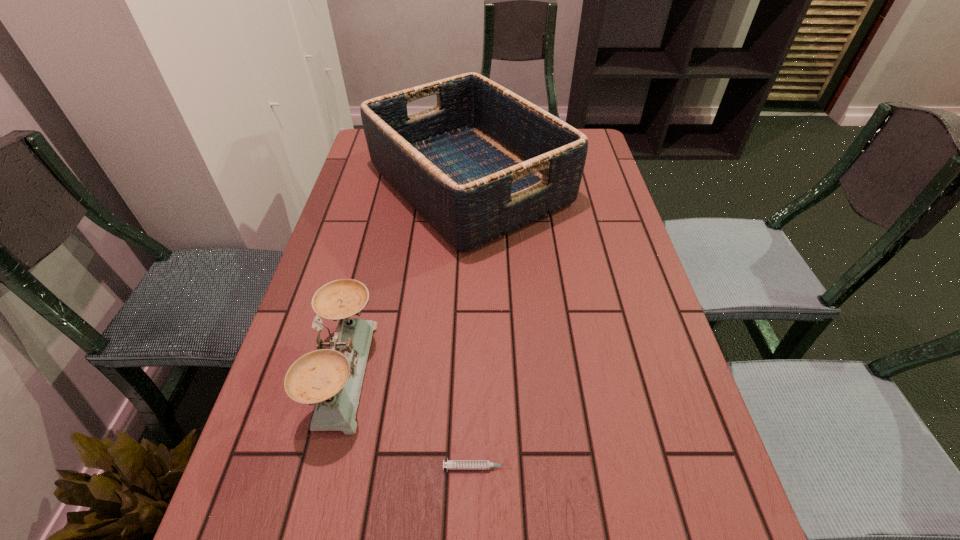
In order to click on the farthest object in this screenshot , I will do `click(484, 162)`.

At what (x,y) coordinates should I click in order to perform the action: click on basket. Please return your answer as a coordinate pair (x, y). The width and height of the screenshot is (960, 540). Looking at the image, I should click on (484, 162).

At what (x,y) coordinates should I click in order to perform the action: click on the second nearest object. Please return your answer as a coordinate pair (x, y). The height and width of the screenshot is (540, 960). Looking at the image, I should click on (331, 377).

Where is `the second tallest object`? This screenshot has height=540, width=960. the second tallest object is located at coordinates (331, 377).

Locate an element on the screen. This screenshot has height=540, width=960. the nearest object is located at coordinates (450, 464).

Locate an element on the screen. The height and width of the screenshot is (540, 960). the shortest object is located at coordinates (450, 464).

The image size is (960, 540). I want to click on free region located 0.320m on the front of the farthest object, so click(464, 364).

Where is `vacant space situated 0.200m on the front-facing side of the scale`? The height and width of the screenshot is (540, 960). vacant space situated 0.200m on the front-facing side of the scale is located at coordinates (470, 372).

At what (x,y) coordinates should I click in order to perform the action: click on free space located 0.250m at the needle end of the syringe. Please return your answer as a coordinate pair (x, y). Looking at the image, I should click on (655, 467).

Find the location of `object at the far edge`. object at the far edge is located at coordinates (484, 162).